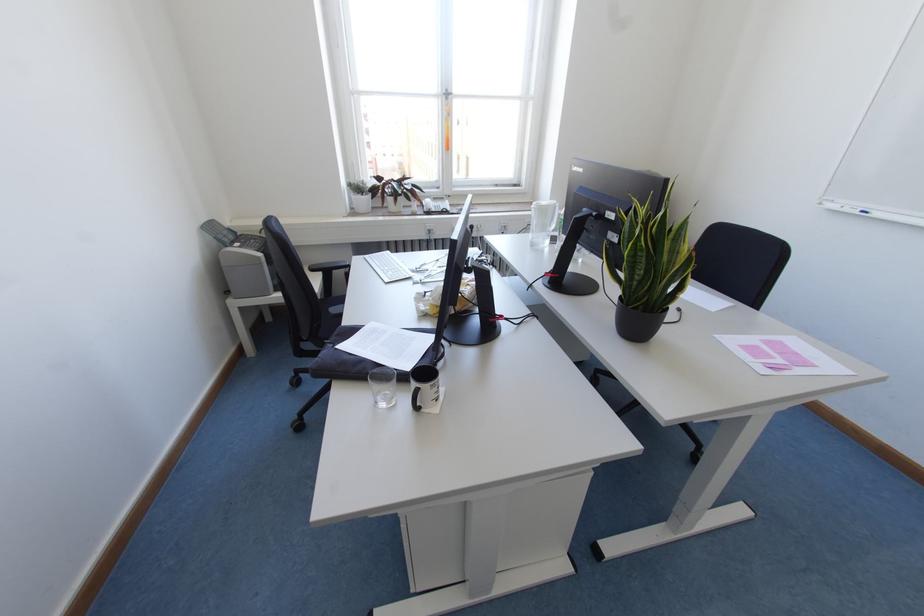
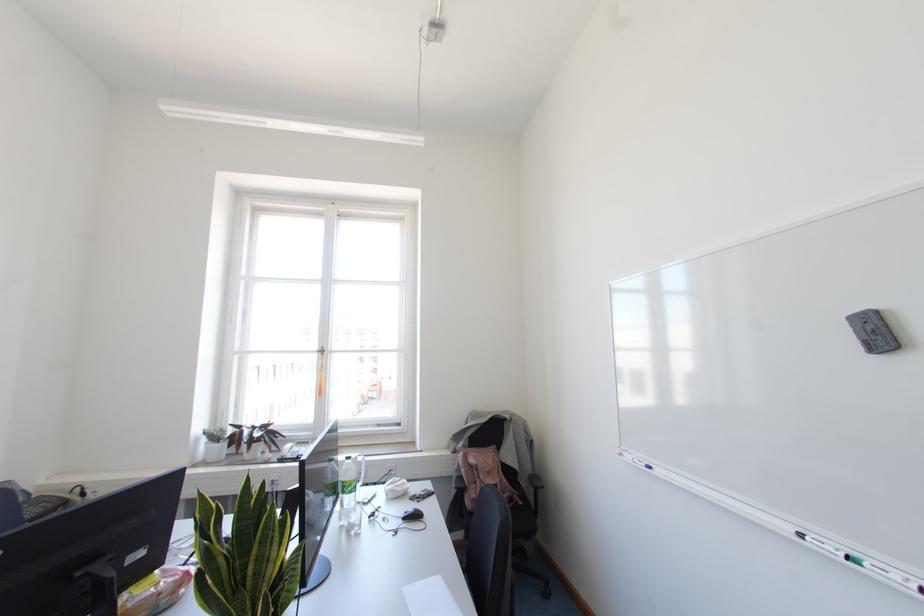
The point at (x=365, y=184) is marked in the first image. Where is the corresponding point in the second image?

(223, 431)